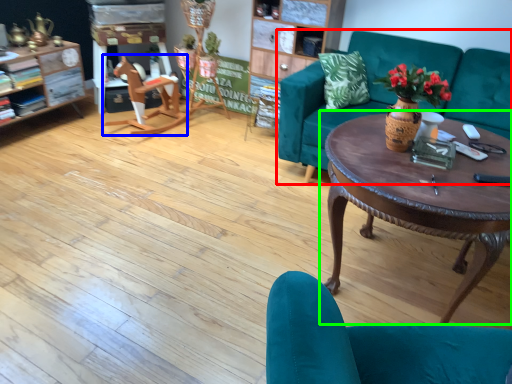
Question: Considering the real-world distances, which object is closest to studio couch (highlighted by a red box)? wide (highlighted by a blue box) or coffee table (highlighted by a green box).

Choices:
 (A) wide
 (B) coffee table

Answer: (B)